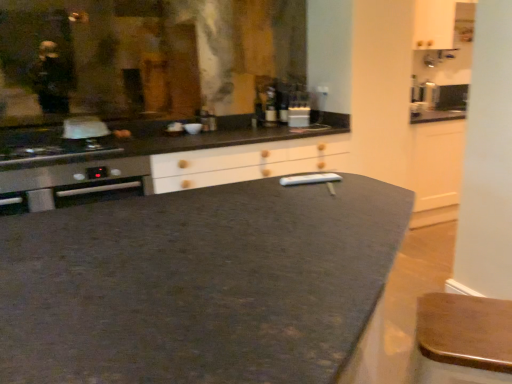
At what (x,y) coordinates should I click in order to perform the action: click on free space above wooden bar stool at lower right (from a real-world perspective). Please return your answer as a coordinate pair (x, y). Looking at the image, I should click on (462, 320).